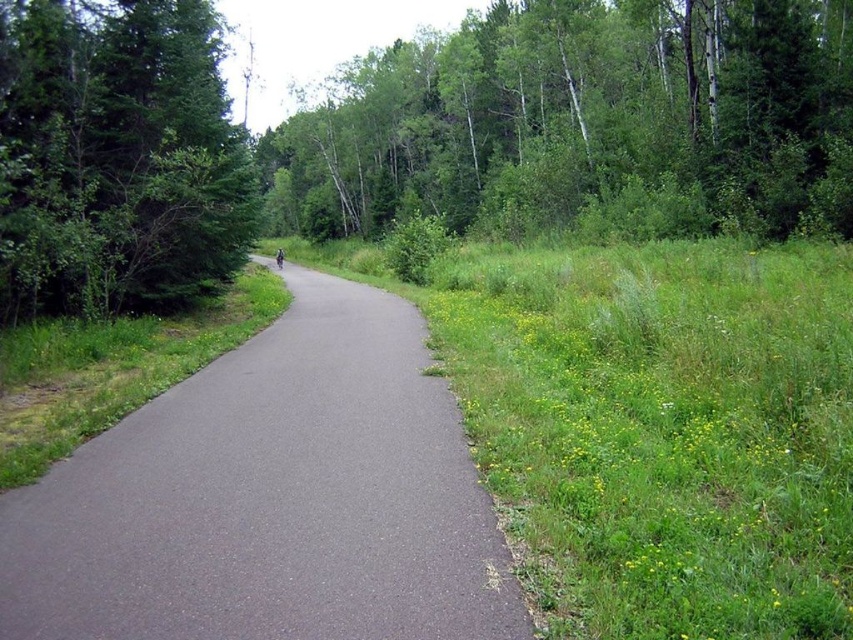
You are a hiker standing at the starting point of the trail. You want to know how far you need to walk to reach the gray asphalt trail at center. Can you determine the distance?

The gray asphalt trail at center is 7.75 feet away from camera, so you need to walk 7.75 feet to reach it.

You are standing at the starting point of the paved path in the image. There are two points marked on the path. The first point is at coordinates point (x=177, y=470) and the second point is at point (x=213, y=280). Which point is closer to you as you begin walking along the path?

Point (x=177, y=470) is closer to the viewer than point (x=213, y=280).